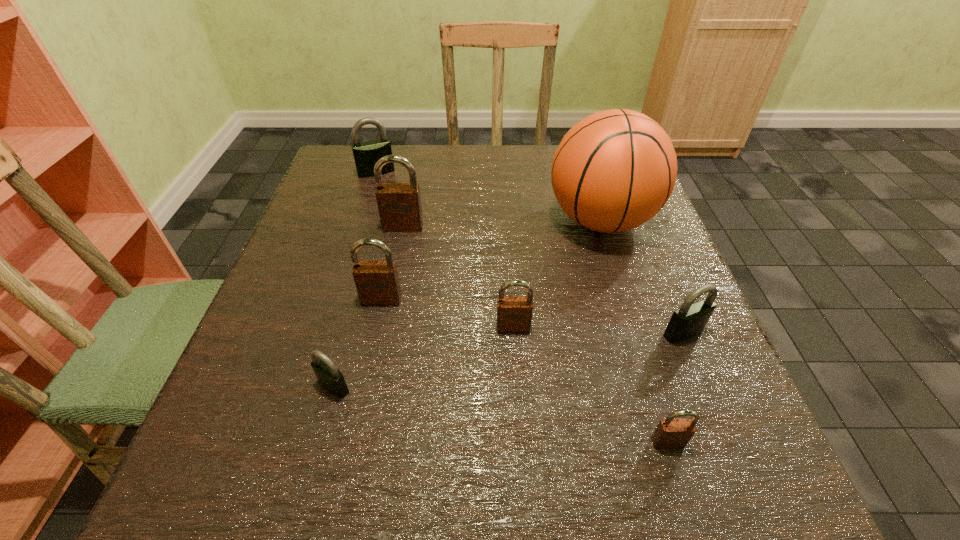
You are a GUI agent. You are given a task and a screenshot of the screen. Output one action in this format:
    pyautogui.click(x=<x>, y=<y>)
    Task: Click on the free space located on the front-facing side of the fifth object from left to right
    This screenshot has width=960, height=540.
    Given the screenshot: What is the action you would take?
    coord(518,399)

This screenshot has height=540, width=960. Identify the location of free location located on the front of the second nearest padlock. (308, 484).

I want to click on basketball positioned at the far edge, so click(x=614, y=170).

Identify the location of padlock located at the far edge. The height and width of the screenshot is (540, 960). (366, 154).

Image resolution: width=960 pixels, height=540 pixels. In order to click on basketball at the right edge in this screenshot , I will do `click(614, 170)`.

You are a GUI agent. You are given a task and a screenshot of the screen. Output one action in this format:
    pyautogui.click(x=<x>, y=<y>)
    Task: Click on the object located at the far left corner
    
    Given the screenshot: What is the action you would take?
    pyautogui.click(x=366, y=154)

Find the location of a particular element. This screenshot has height=540, width=960. object that is at the far right corner is located at coordinates (614, 170).

Locate an element on the screen. This screenshot has width=960, height=540. free space at the far edge of the desktop is located at coordinates point(440,163).

You are a GUI agent. You are given a task and a screenshot of the screen. Output one action in this format:
    pyautogui.click(x=<x>, y=<y>)
    Task: Click on the vacant area at the left edge of the desktop
    Image resolution: width=960 pixels, height=540 pixels.
    Given the screenshot: What is the action you would take?
    pyautogui.click(x=331, y=217)

Locate an element on the screen. This screenshot has height=540, width=960. vacant space at the right edge of the desktop is located at coordinates (657, 319).